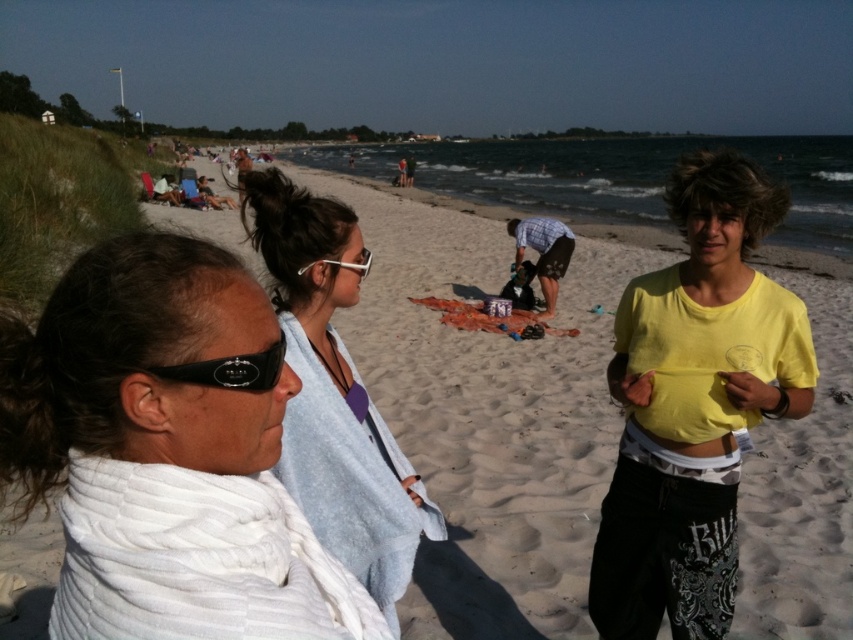
The height and width of the screenshot is (640, 853). In order to click on white towel at left in this screenshot , I will do `click(166, 451)`.

Can you confirm if white towel at left is positioned to the left of black rubber goggles at left?

Yes, white towel at left is to the left of black rubber goggles at left.

Identify the location of white towel at left. (166, 451).

Can you confirm if white towel at left is positioned below white towel at center?

Yes, white towel at left is below white towel at center.

Is point (218, 609) positioned in front of point (296, 406)?

Yes, it is.

This screenshot has width=853, height=640. What are the coordinates of `white towel at left` in the screenshot? It's located at (166, 451).

This screenshot has height=640, width=853. Find the location of `white towel at left`. white towel at left is located at coordinates (166, 451).

Between white towel at center and black rubber goggles at left, which one appears on the right side from the viewer's perspective?

black rubber goggles at left

Which is in front, point (294, 246) or point (184, 376)?

Point (184, 376) is in front.

Which is behind, point (310, 275) or point (165, 378)?

Positioned behind is point (310, 275).

Locate an element on the screen. The image size is (853, 640). white towel at center is located at coordinates (335, 394).